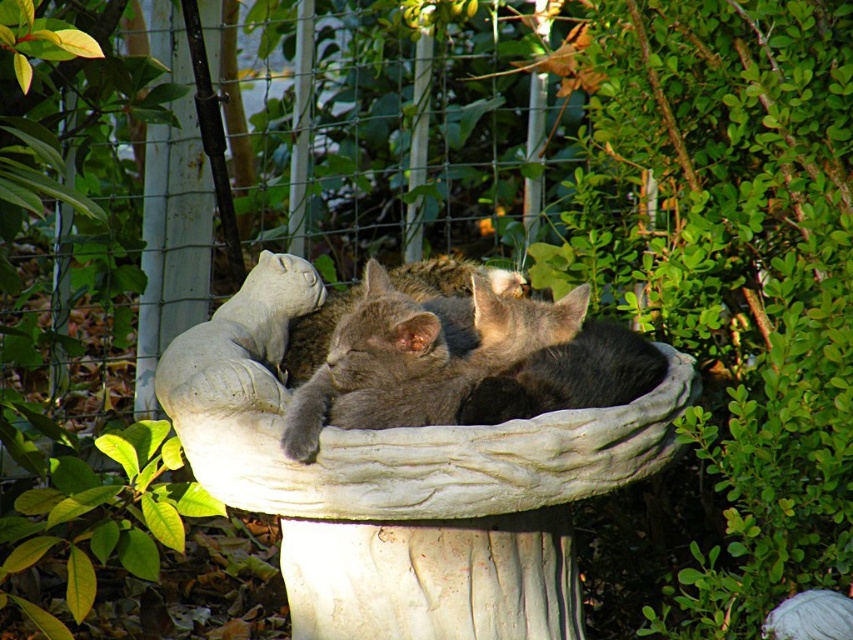
What do you see at coordinates (244, 180) in the screenshot?
I see `metallic wire fence at upper center` at bounding box center [244, 180].

Does point (171, 326) lie behind point (340, 385)?

Yes.

You are a GUI agent. You are given a task and a screenshot of the screen. Output one action in this format:
    pyautogui.click(x=<x>, y=<y>)
    Task: Click on the metallic wire fence at upper center
    The width and height of the screenshot is (853, 640).
    Given the screenshot: What is the action you would take?
    pyautogui.click(x=244, y=180)

Who is shorter, metallic wire fence at upper center or white stone bowl at center?

With less height is white stone bowl at center.

Which of these two, metallic wire fence at upper center or white stone bowl at center, stands taller?

metallic wire fence at upper center is taller.

Where is `metallic wire fence at upper center`? The image size is (853, 640). metallic wire fence at upper center is located at coordinates (244, 180).

This screenshot has height=640, width=853. Identify the location of white stone bowl at center. (403, 484).

How distant is white stone bowl at center from gray soft fur cat at center?

white stone bowl at center is 3.88 inches away from gray soft fur cat at center.

The height and width of the screenshot is (640, 853). What do you see at coordinates (403, 484) in the screenshot?
I see `white stone bowl at center` at bounding box center [403, 484].

Find the location of a particular element. This screenshot has height=640, width=853. white stone bowl at center is located at coordinates (403, 484).